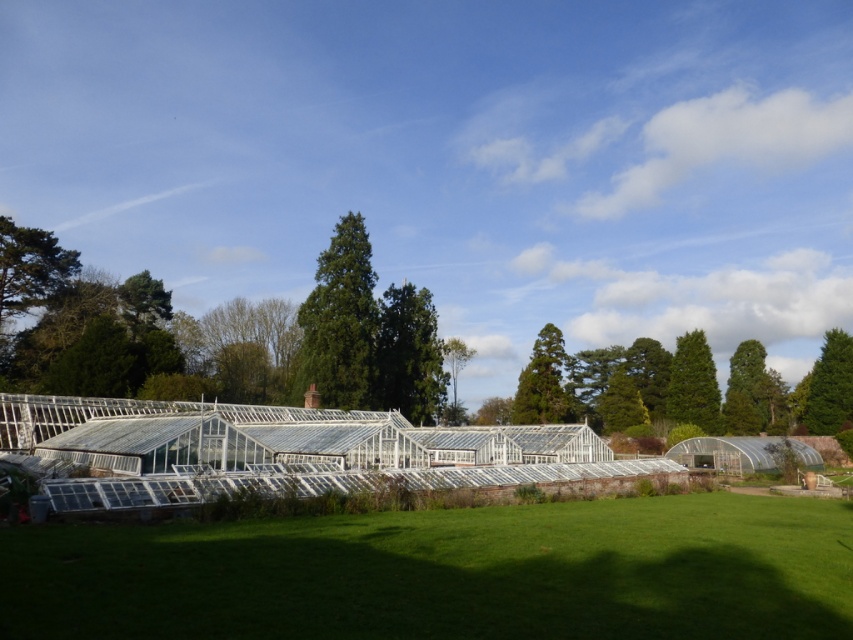
Question: Among these points, which one is farthest from the camera?

Choices:
 (A) (616, 369)
 (B) (347, 404)
 (C) (531, 388)
 (D) (759, 417)

Answer: (A)

Question: Which point is farther to the camera?

Choices:
 (A) (352, 394)
 (B) (450, 353)

Answer: (B)

Question: Which object is closer to the camera taking this photo?

Choices:
 (A) green textured tree at right
 (B) green leafy tree at center

Answer: (B)

Question: Is transparent glass greenhouse at lower center positioned before green textured tree at right?

Choices:
 (A) no
 (B) yes

Answer: (B)

Question: Does transparent glass greenhouse at lower center appear on the right side of green glossy tree at upper center?

Choices:
 (A) no
 (B) yes

Answer: (A)

Question: In this image, where is green leafy tree at upper left located relative to green leafy tree at upper right?

Choices:
 (A) left
 (B) right

Answer: (A)